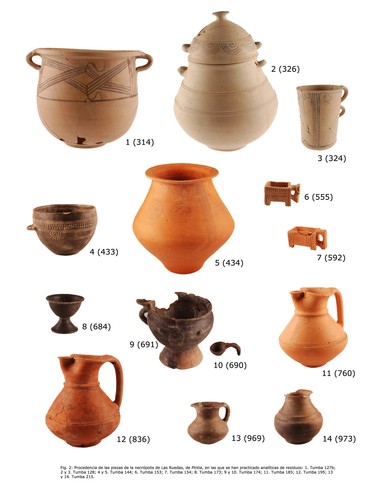
Where is `brown vase, lower right corner`? This screenshot has width=376, height=500. brown vase, lower right corner is located at coordinates (299, 410).